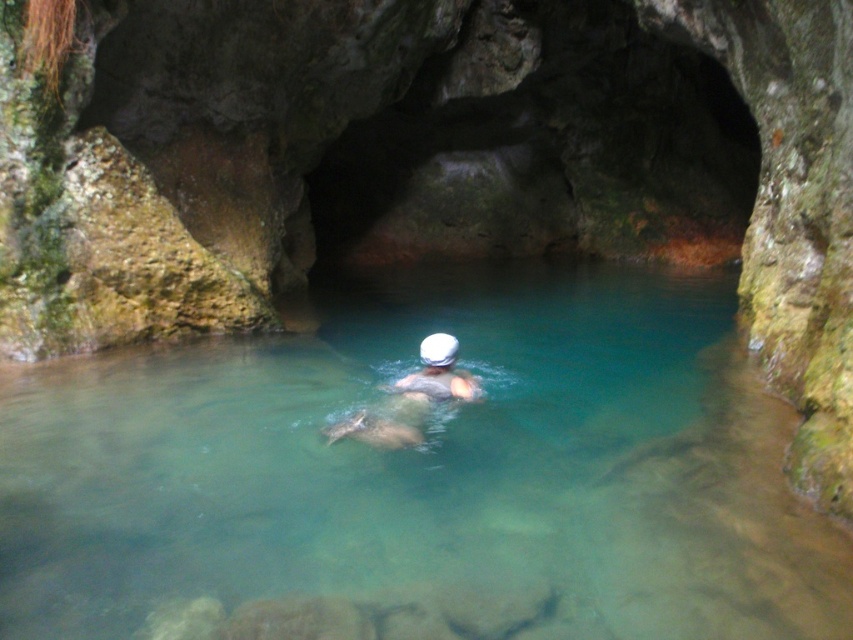
Who is positioned more to the right, clear water at center or white matte swim cap at center?

clear water at center is more to the right.

Who is shorter, clear water at center or white matte swim cap at center?

white matte swim cap at center

Which is behind, point (173, 355) or point (415, 413)?

Positioned behind is point (173, 355).

You are a GUI agent. You are given a task and a screenshot of the screen. Output one action in this format:
    pyautogui.click(x=<x>, y=<y>)
    Task: Click on the clear water at center
    The height and width of the screenshot is (640, 853).
    Given the screenshot: What is the action you would take?
    pyautogui.click(x=422, y=476)